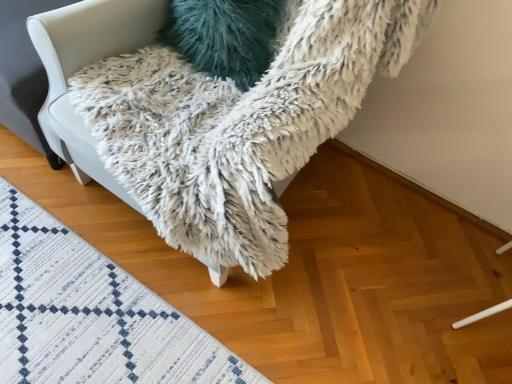
At what (x,y) coordinates should I click in order to perform the action: click on free space above white woven mat at lower left (from a real-world perspective). Please return your answer as a coordinate pair (x, y). Image resolution: width=512 pixels, height=384 pixels. Looking at the image, I should click on (77, 314).